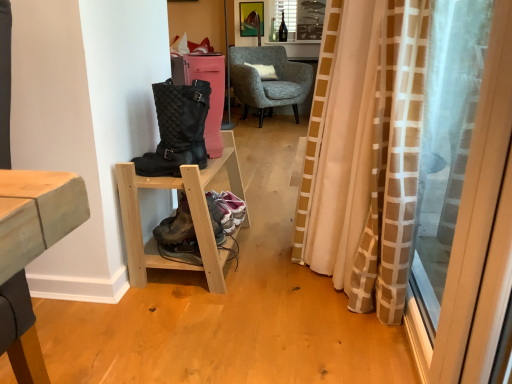
Measure the distance between point (249, 219) and camera.

Point (249, 219) is 7.57 feet from camera.

Measure the distance between point (218,237) and camera.

The distance of point (218,237) from camera is 1.78 meters.

Describe the element at coordinates (365, 152) in the screenshot. I see `beige/white checkered curtain at right` at that location.

The height and width of the screenshot is (384, 512). Describe the element at coordinates (251, 19) in the screenshot. I see `metallic gold picture frame at upper center` at that location.

This screenshot has width=512, height=384. Describe the element at coordinates (264, 71) in the screenshot. I see `white soft cushion at center` at that location.

Identify the location of transparent plastic screen door at right. (471, 215).

The height and width of the screenshot is (384, 512). What are the coordinates of `light wood/unfinished wood shelf at lower left` in the screenshot? It's located at (191, 214).

Which is more to the left, light wood/unfinished wood shelf at lower left or textured gray armchair at center?

light wood/unfinished wood shelf at lower left is more to the left.

Is light wood/unfinished wood shelf at lower left not inside textured gray armchair at center?

Yes, light wood/unfinished wood shelf at lower left is located beyond the bounds of textured gray armchair at center.

Is light wood/unfinished wood shelf at lower left looking in the opposite direction of textured gray armchair at center?

No, light wood/unfinished wood shelf at lower left is not facing away from textured gray armchair at center.

Looking at this image, could you tell me if black quilted boots at left is turned towards clear glass window at upper center?

No.

Is point (169, 154) closer to camera compared to point (303, 11)?

Yes, point (169, 154) is closer to viewer.

Looking at this image, considering the positions of objects black quilted boots at left and clear glass window at upper center in the image provided, who is more to the right, black quilted boots at left or clear glass window at upper center?

clear glass window at upper center.

Considering their positions, is black quilted boots at left located in front of or behind clear glass window at upper center?

black quilted boots at left is in front of clear glass window at upper center.

How much distance is there between leather/mesh hiking boots at lower center and black quilted boots at left?

A distance of 13.33 inches exists between leather/mesh hiking boots at lower center and black quilted boots at left.

From a real-world perspective, is leather/mesh hiking boots at lower center on black quilted boots at left?

Actually, leather/mesh hiking boots at lower center is physically below black quilted boots at left in the real world.

Does leather/mesh hiking boots at lower center have a lesser height compared to black quilted boots at left?

Indeed, leather/mesh hiking boots at lower center has a lesser height compared to black quilted boots at left.

Considering the relative sizes of leather/mesh hiking boots at lower center and black quilted boots at left in the image provided, is leather/mesh hiking boots at lower center bigger than black quilted boots at left?

Actually, leather/mesh hiking boots at lower center might be smaller than black quilted boots at left.

Considering the points (280, 5) and (273, 87), which point is behind, point (280, 5) or point (273, 87)?

The point (280, 5) is farther.

Looking at this image, from a real-world perspective, is clear glass window at upper center under textured gray armchair at center?

No, from a real-world perspective, clear glass window at upper center is not under textured gray armchair at center.

Is clear glass window at upper center positioned far away from textured gray armchair at center?

That's not correct — clear glass window at upper center is a little close to textured gray armchair at center.

Is clear glass window at upper center oriented towards textured gray armchair at center?

Yes, clear glass window at upper center is facing textured gray armchair at center.

Consider the image. From a real-world perspective, who is located higher, beige/white checkered curtain at right or textured gray armchair at center?

beige/white checkered curtain at right.

How much distance is there between beige/white checkered curtain at right and textured gray armchair at center?

beige/white checkered curtain at right is 2.99 meters from textured gray armchair at center.

Considering the points (460, 176) and (254, 81), which point is in front, point (460, 176) or point (254, 81)?

The point (460, 176) is in front.

Is beige/white checkered curtain at right positioned far away from textured gray armchair at center?

beige/white checkered curtain at right is positioned a significant distance from textured gray armchair at center.

From the image's perspective, which is below, beige/white checkered curtain at right or light wood/unfinished wood shelf at lower left?

light wood/unfinished wood shelf at lower left is shown below in the image.

Can you tell me how much beige/white checkered curtain at right and light wood/unfinished wood shelf at lower left differ in facing direction?

There is a 180-degree angle between the facing directions of beige/white checkered curtain at right and light wood/unfinished wood shelf at lower left.

Which is more distant, (325, 239) or (209, 165)?

The point (325, 239) is farther.

Does beige/white checkered curtain at right have a lesser height compared to light wood/unfinished wood shelf at lower left?

No, beige/white checkered curtain at right is not shorter than light wood/unfinished wood shelf at lower left.

From a real-world perspective, is leather/mesh hiking boots at lower center over textured gray armchair at center?

Actually, leather/mesh hiking boots at lower center is physically below textured gray armchair at center in the real world.

Are leather/mesh hiking boots at lower center and textured gray armchair at center beside each other?

No.

How different are the orientations of leather/mesh hiking boots at lower center and textured gray armchair at center in degrees?

128 degrees separate the facing orientations of leather/mesh hiking boots at lower center and textured gray armchair at center.

At what (x,y) coordinates should I click in order to perform the action: click on chair on the right of light wood/unfinished wood shelf at lower left. Please return your answer as a coordinate pair (x, y). Looking at the image, I should click on (269, 80).

I want to click on boots lying below the clear glass window at upper center (from the image's perspective), so click(x=177, y=129).

Which object lies nearer to the anchor point clear glass window at upper center, metallic gold picture frame at upper center or textured gray armchair at center?

The object closer to clear glass window at upper center is metallic gold picture frame at upper center.

From the image, which object appears to be farther from leather/mesh hiking boots at lower center, beige/white checkered curtain at right or light wood/unfinished wood shelf at lower left?

beige/white checkered curtain at right is further to leather/mesh hiking boots at lower center.

Considering their positions, is textured gray armchair at center positioned closer to transparent plastic screen door at right than black quilted boots at left?

black quilted boots at left is closer to transparent plastic screen door at right.

Looking at the image, which one is located closer to black quilted boots at left, transparent plastic screen door at right or white soft cushion at center?

Among the two, transparent plastic screen door at right is located nearer to black quilted boots at left.

Looking at the image, which one is located closer to metallic gold picture frame at upper center, black quilted boots at left or white soft cushion at center?

Among the two, white soft cushion at center is located nearer to metallic gold picture frame at upper center.

From the image, which object appears to be farther from leather/mesh hiking boots at lower center, white soft cushion at center or transparent plastic screen door at right?

Among the two, white soft cushion at center is located further to leather/mesh hiking boots at lower center.

When comparing their distances from textured gray armchair at center, does light wood/unfinished wood shelf at lower left or black quilted boots at left seem closer?

light wood/unfinished wood shelf at lower left lies closer to textured gray armchair at center than the other object.

Looking at the image, which one is located further to white soft cushion at center, beige/white checkered curtain at right or black quilted boots at left?

The object further to white soft cushion at center is beige/white checkered curtain at right.

Identify the location of chair between beige/white checkered curtain at right and white soft cushion at center from front to back. This screenshot has width=512, height=384. (269, 80).

I want to click on shelf between black quilted boots at left and transparent plastic screen door at right in the horizontal direction, so click(191, 214).

This screenshot has width=512, height=384. Identify the location of window between white soft cushion at center and metallic gold picture frame at upper center in the front-back direction. (297, 20).

Locate an element on the screen. This screenshot has width=512, height=384. chair between leather/mesh hiking boots at lower center and white soft cushion at center from front to back is located at coordinates (269, 80).